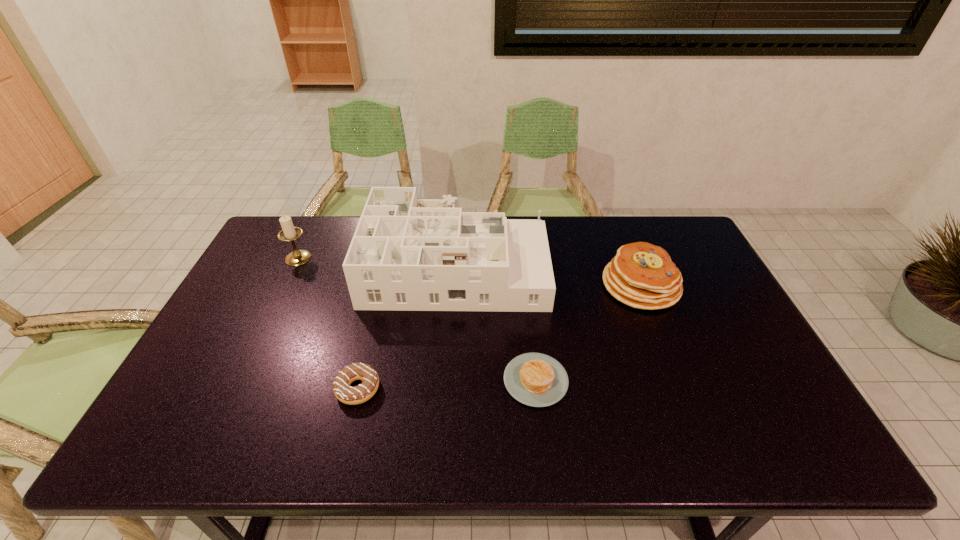
Identify the location of dollhouse. tap(407, 254).

Image resolution: width=960 pixels, height=540 pixels. I want to click on the leftmost object, so click(288, 233).

In order to click on the rightmost object in this screenshot , I will do `click(641, 275)`.

The image size is (960, 540). In order to click on the farther pancake in this screenshot , I will do `click(641, 275)`.

Locate an element on the screen. doughnut is located at coordinates (343, 391).

This screenshot has width=960, height=540. What are the coordinates of `the left pancake` in the screenshot? It's located at (534, 379).

What are the coordinates of `the nearer pancake` in the screenshot? It's located at (534, 379).

Find the location of a particular element. This screenshot has width=960, height=540. free space located on the left of the dollhouse is located at coordinates (255, 265).

The height and width of the screenshot is (540, 960). Find the location of `free location located 0.100m on the back of the leftmost object`. free location located 0.100m on the back of the leftmost object is located at coordinates (311, 232).

Locate an element on the screen. This screenshot has width=960, height=540. vacant position located 0.140m on the left of the right pancake is located at coordinates (557, 285).